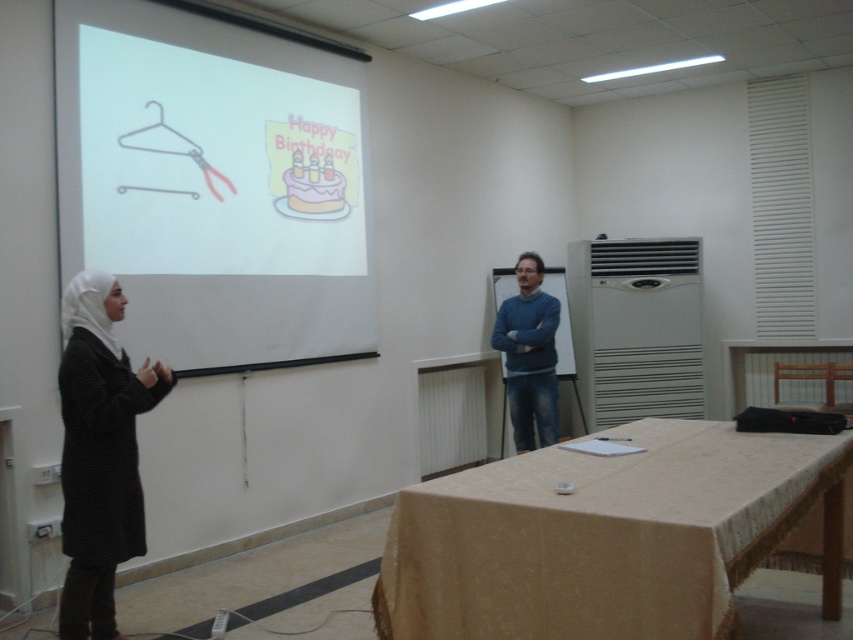
Who is higher up, white matte projection screen at upper left or blue sweater at center?

white matte projection screen at upper left

Does white matte projection screen at upper left have a greater width compared to blue sweater at center?

Yes, white matte projection screen at upper left is wider than blue sweater at center.

Identify the location of white matte projection screen at upper left. (213, 186).

Can you confirm if white matte projection screen at upper left is positioned below metallic hanger at upper left?

Yes, white matte projection screen at upper left is below metallic hanger at upper left.

Can you confirm if white matte projection screen at upper left is positioned to the right of metallic hanger at upper left?

Correct, you'll find white matte projection screen at upper left to the right of metallic hanger at upper left.

Which is behind, point (331, 275) or point (199, 166)?

The point (331, 275) is behind.

You are a GUI agent. You are given a task and a screenshot of the screen. Output one action in this format:
    pyautogui.click(x=<x>, y=<y>)
    Task: Click on the white matte projection screen at upper left
    
    Given the screenshot: What is the action you would take?
    pyautogui.click(x=213, y=186)

Is blue sweater at center positioned behind metallic hanger at upper left?

Yes, it is behind metallic hanger at upper left.

Does point (509, 316) come behind point (171, 148)?

Yes, it is behind point (171, 148).

Is point (519, 291) more distant than point (161, 106)?

Yes.

At what (x,y) coordinates should I click in order to perform the action: click on blue sweater at center. Please return your answer as a coordinate pair (x, y). The width and height of the screenshot is (853, 640). Looking at the image, I should click on (529, 355).